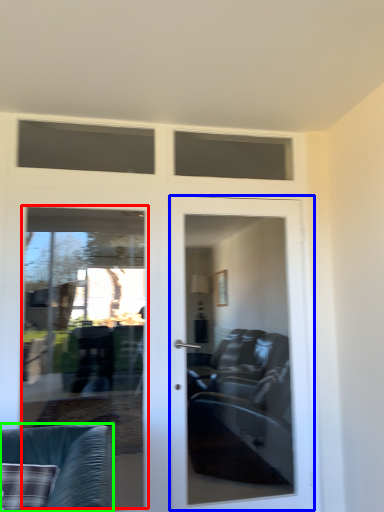
Question: Which object is positioned farthest from screen door (highlighted by a red box)? Select from door (highlighted by a blue box) and chair (highlighted by a green box).

Choices:
 (A) door
 (B) chair

Answer: (B)